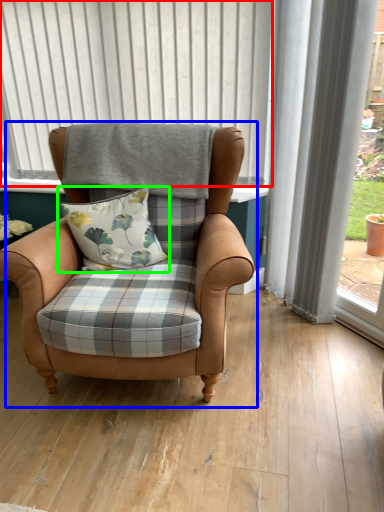
Question: Which object is the farthest from bay window (highlighted by a red box)? Choose among these: chair (highlighted by a blue box) or pillow (highlighted by a green box).

Choices:
 (A) chair
 (B) pillow

Answer: (B)